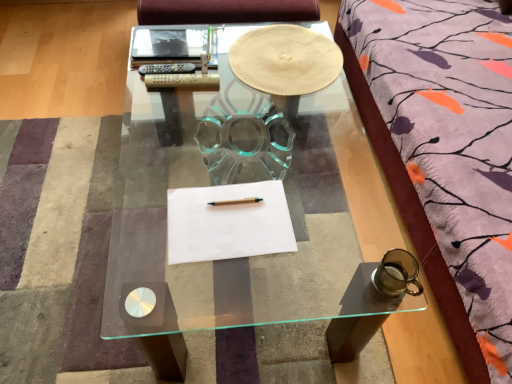
Where is `free space in front of wooden pencil at center`? free space in front of wooden pencil at center is located at coordinates (225, 236).